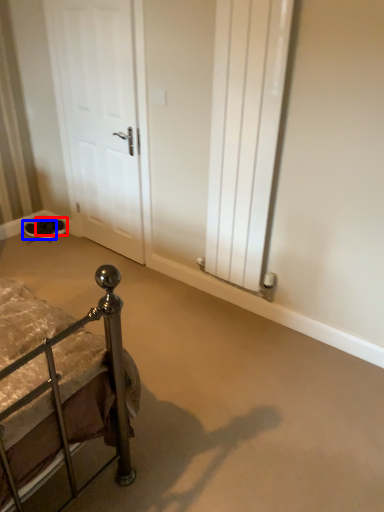
Question: Which of the following is the closest to the observer, footwear (highlighted by a red box) or footwear (highlighted by a blue box)?

Choices:
 (A) footwear
 (B) footwear

Answer: (B)